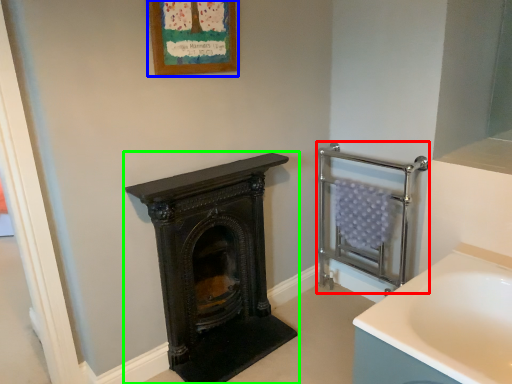
Question: Which object is positioned farthest from balustrade (highlighted by a red box)? Select from picture frame (highlighted by a blue box) and wood burning stove (highlighted by a green box).

Choices:
 (A) picture frame
 (B) wood burning stove

Answer: (A)